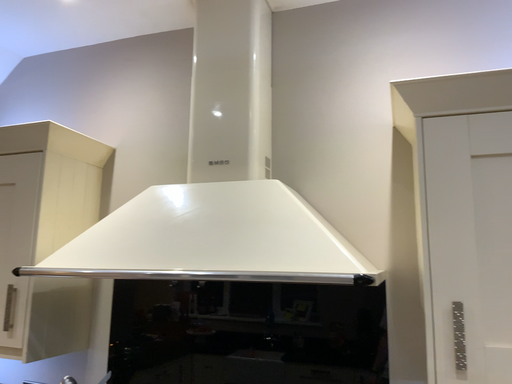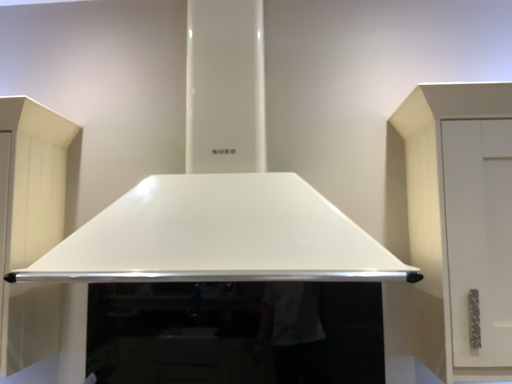
Question: How did the camera likely rotate when shooting the video?

Choices:
 (A) rotated left
 (B) rotated right

Answer: (B)